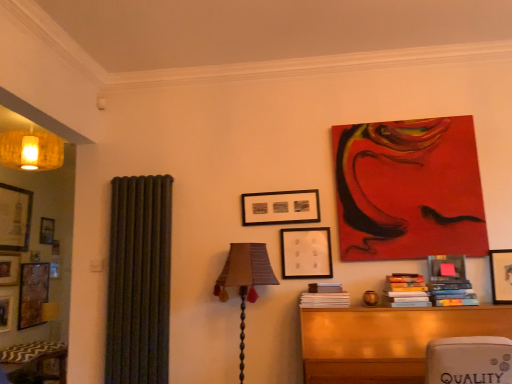
Question: Is wooden table at lower right in front of or behind matte black picture frame at center, placed as the 2th picture frame when sorted from front to back, in the image?

Choices:
 (A) behind
 (B) front

Answer: (B)

Question: Is wooden table at lower right taller or shorter than matte black picture frame at center, placed as the 2th picture frame when sorted from front to back?

Choices:
 (A) short
 (B) tall

Answer: (B)

Question: Which object is positioned farthest from the textured fabric lampshade at center?

Choices:
 (A) black matte picture frame at center, arranged as the 3th picture frame when viewed from the front
 (B) hardcover books at center-right, the 2th book viewed from the left
 (C) hardcover books at right, positioned as the third book in left-to-right order
 (D) wooden table at lower right
 (E) red acrylic painting at upper right

Answer: (C)

Question: Which of these objects is positioned closest to the black matte picture frame at center, marked as the first picture frame in a left-to-right arrangement?

Choices:
 (A) red acrylic painting at upper right
 (B) wooden book at lower right, the third book when ordered from right to left
 (C) wooden table at lower right
 (D) wooden picture frame at upper right, the first picture frame in the right-to-left sequence
 (E) hardcover books at right, positioned as the third book in left-to-right order

Answer: (B)